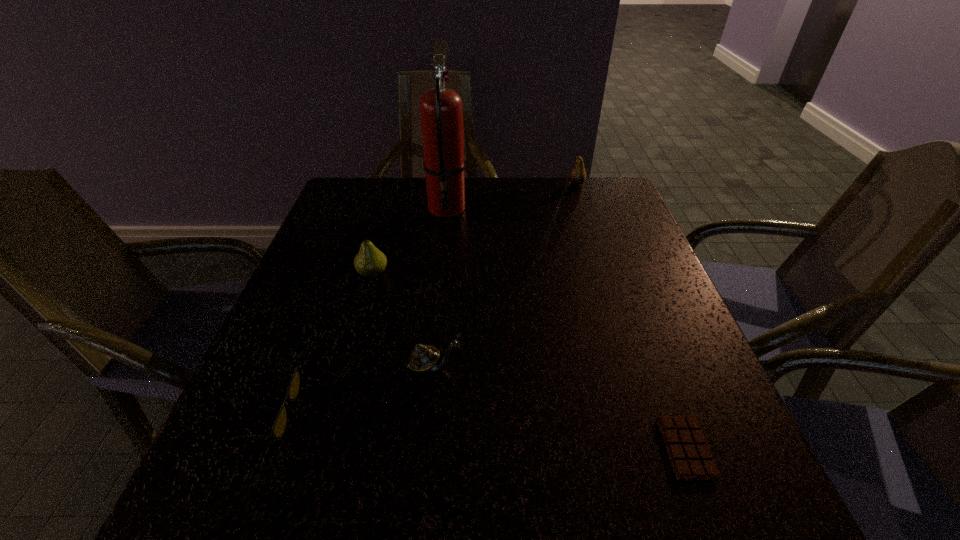
You are a GUI agent. You are given a task and a screenshot of the screen. Output one action in this format:
    pyautogui.click(x=<x>, y=<y>)
    Task: Click on the sunglasses that is at the left edge
    The image size is (960, 540).
    Given the screenshot: What is the action you would take?
    pyautogui.click(x=279, y=426)

Where is `pear present at the right edge`? The image size is (960, 540). pear present at the right edge is located at coordinates (577, 176).

Find the location of a particular element. The height and width of the screenshot is (540, 960). candy bar located in the right edge section of the desktop is located at coordinates (689, 453).

This screenshot has height=540, width=960. Find the location of `object that is at the far right corner`. object that is at the far right corner is located at coordinates 577,176.

At what (x,y) coordinates should I click in order to perform the action: click on object at the near right corner. Please return your answer as a coordinate pair (x, y). Looking at the image, I should click on (689, 453).

I want to click on vacant space at the far edge of the desktop, so click(x=475, y=180).

In order to click on free region at the near edge of the desktop in this screenshot , I will do `click(326, 485)`.

Where is `vacant area at the left edge of the desktop`? vacant area at the left edge of the desktop is located at coordinates (335, 273).

Find the location of a particular element. vacant space at the right edge is located at coordinates (646, 259).

I want to click on vacant space at the far left corner, so click(x=386, y=187).